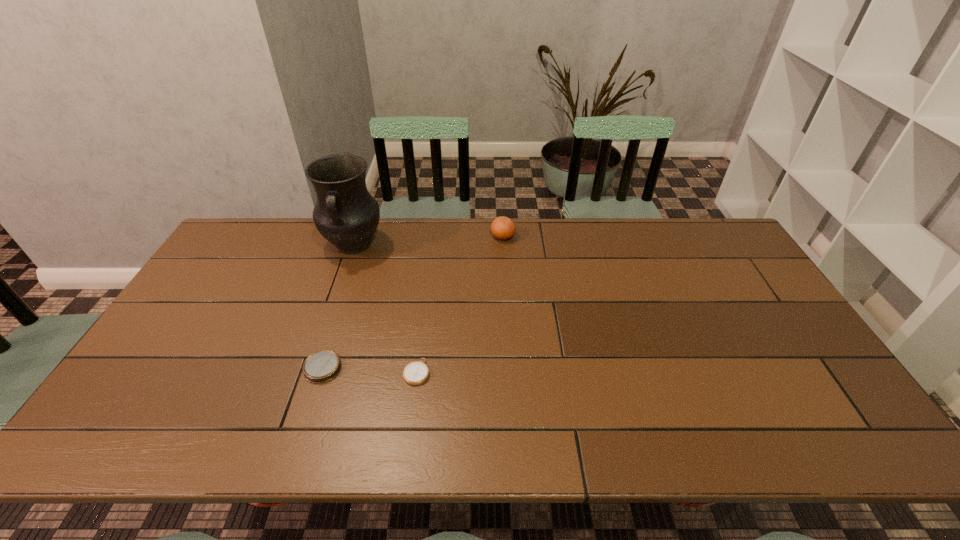
At what (x,y) coordinates should I click in order to perform the action: click on the tallest object. Please return your answer as a coordinate pair (x, y). Looking at the image, I should click on 345,214.

You are a GUI agent. You are given a task and a screenshot of the screen. Output one action in this format:
    pyautogui.click(x=<x>, y=<y>)
    Task: Click on the clementine
    
    Given the screenshot: What is the action you would take?
    pyautogui.click(x=503, y=228)

Where is `the rightmost object`? the rightmost object is located at coordinates (503, 228).

Find the location of `the taller compass`. the taller compass is located at coordinates click(x=322, y=366).

Where is `the second shortest object`? the second shortest object is located at coordinates (322, 366).

Image resolution: width=960 pixels, height=540 pixels. What are the coordinates of `the shortest object` in the screenshot? It's located at (415, 373).

Where is `the shorter compass`? The width and height of the screenshot is (960, 540). the shorter compass is located at coordinates (415, 373).

You are a GUI agent. You are given a task and a screenshot of the screen. Output one action in this format:
    pyautogui.click(x=<x>, y=<y>)
    Task: Click on the free space located on the handle side of the pitcher
    Image resolution: width=960 pixels, height=540 pixels.
    Given the screenshot: What is the action you would take?
    pyautogui.click(x=322, y=339)

Locate an element on the screen. blank space located on the left of the third shortest object is located at coordinates (379, 237).

This screenshot has height=540, width=960. Find the location of `free space located 0.090m on the front of the left compass`. free space located 0.090m on the front of the left compass is located at coordinates (307, 416).